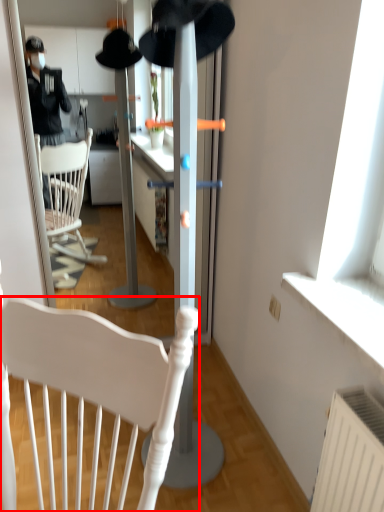
Question: Observing the image, what is the correct spatial positioning of chair (annotated by the red box) in reference to hat?

Choices:
 (A) right
 (B) left

Answer: (B)